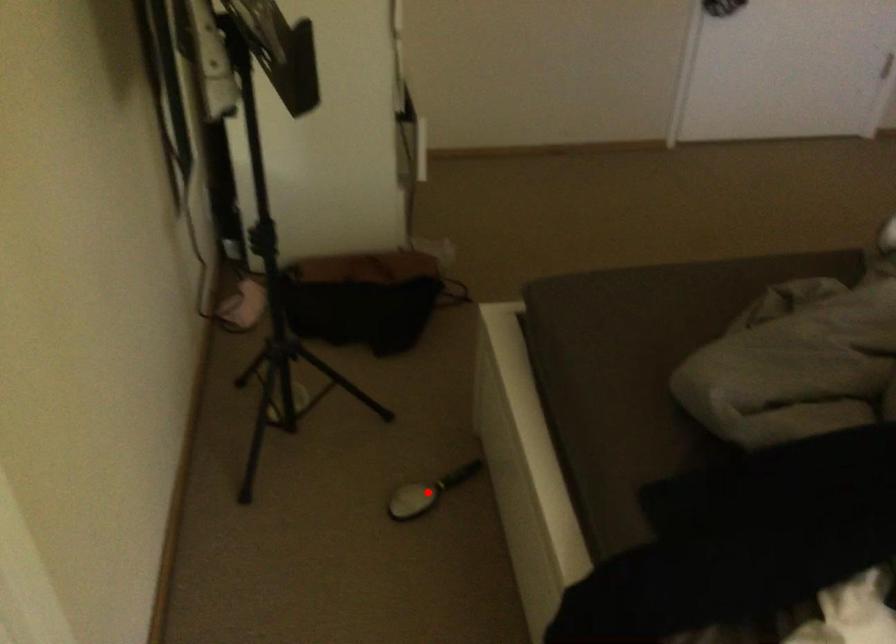
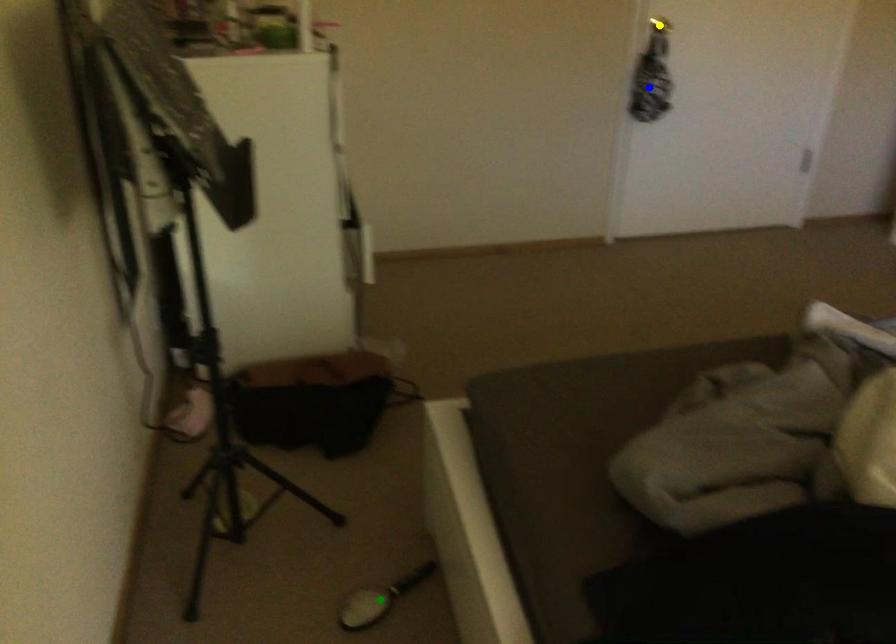
Question: I am providing you with two images of the same scene from different viewpoints. A red point is marked on the first image. You are given multiple points on the second image. Which point in image 2 represents the same 3d spot as the red point in image 1?

Choices:
 (A) blue point
 (B) yellow point
 (C) green point

Answer: (C)